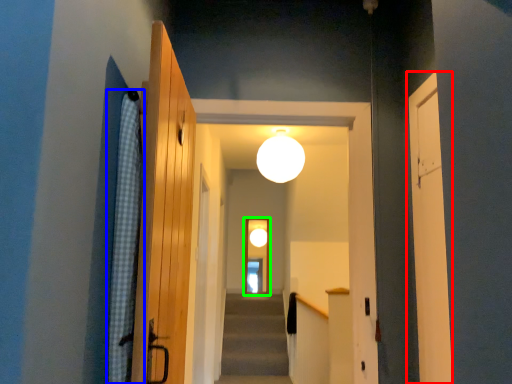
Question: Estimate the real-world distances between objects in this image. Which object is farther from door (highlighted by a red box), curtain (highlighted by a blue box) or screen door (highlighted by a green box)?

Choices:
 (A) curtain
 (B) screen door

Answer: (B)